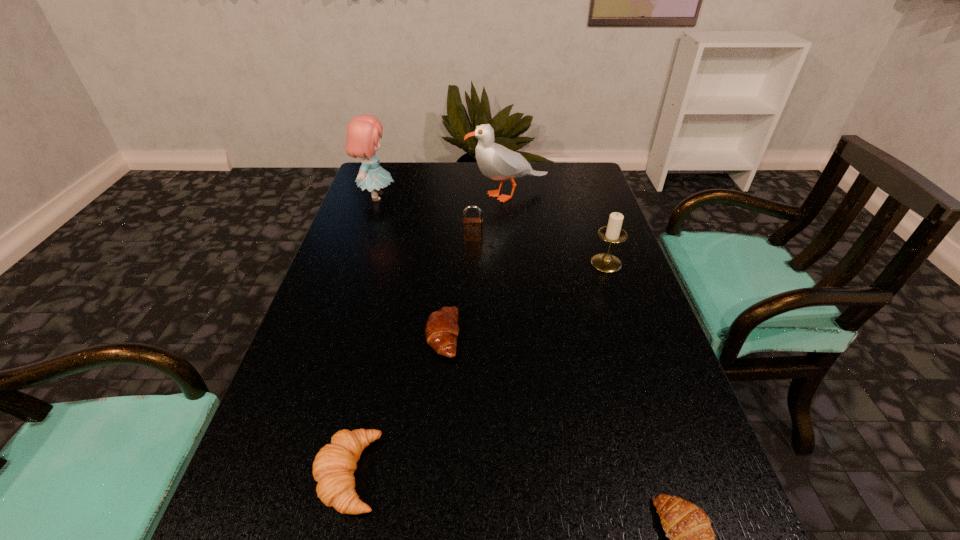
Identify the location of doll located in the left edge section of the desktop. (363, 132).

Identify the location of crescent roll present at the left edge. (333, 468).

Find the location of `object located in the right edge section of the desktop`. object located in the right edge section of the desktop is located at coordinates (605, 262).

Locate an element on the screen. object that is positioned at the far left corner is located at coordinates (363, 132).

In order to click on free location at the far edge in this screenshot , I will do `click(509, 187)`.

Identify the location of free space at the left edge of the desktop. This screenshot has height=540, width=960. (316, 301).

The height and width of the screenshot is (540, 960). In the image, there is a desktop. In order to click on vacant space at the right edge in this screenshot , I will do `click(686, 417)`.

In the image, there is a desktop. In order to click on vacant space at the far right corner in this screenshot , I will do `click(578, 171)`.

In order to click on free space between the tallest crescent roll and the doll in this screenshot , I will do `click(363, 335)`.

The height and width of the screenshot is (540, 960). I want to click on free spot between the second crescent roll from left to right and the doll, so click(409, 266).